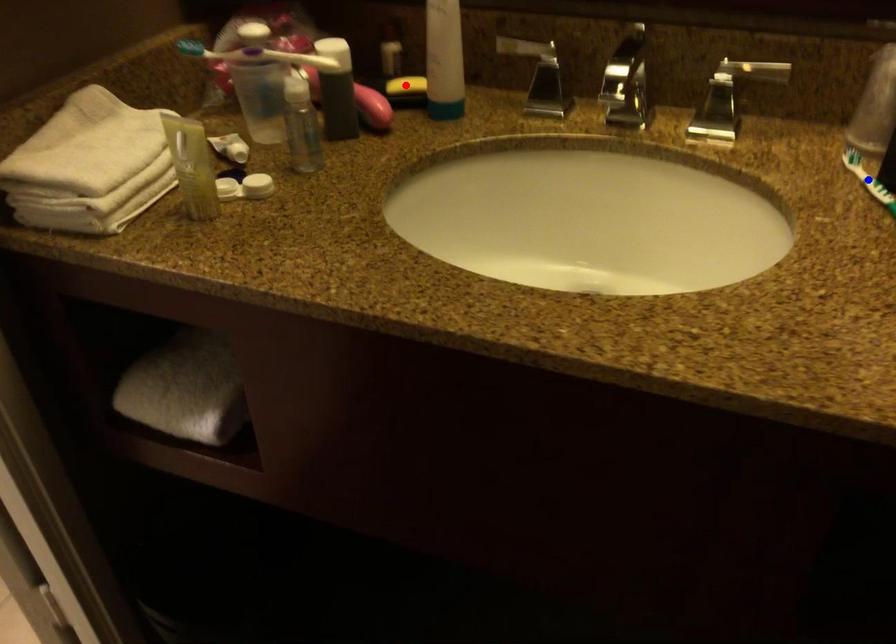
Question: Which of the two points in the image is closer to the camera?

Choices:
 (A) Blue point is closer.
 (B) Red point is closer.

Answer: (A)